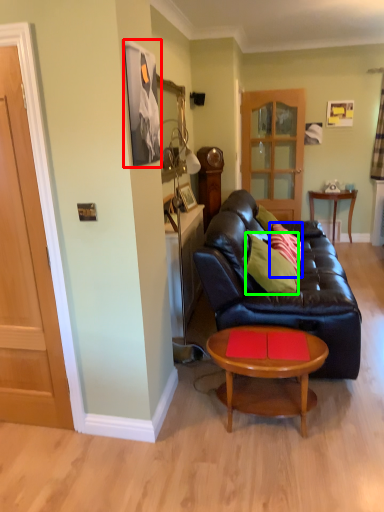
Question: Based on their relative distances, which object is farther from picture frame (highlighted by a red box)? Choose from pillow (highlighted by a blue box) and pillow (highlighted by a green box).

Choices:
 (A) pillow
 (B) pillow

Answer: (A)